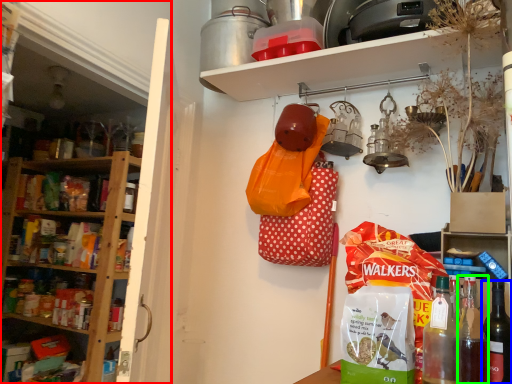
Question: Based on their relative distances, which object is nearer to shelf (highlighted by a red box)? Choose from bottle (highlighted by a blue box) and bottle (highlighted by a green box).

Choices:
 (A) bottle
 (B) bottle

Answer: (B)